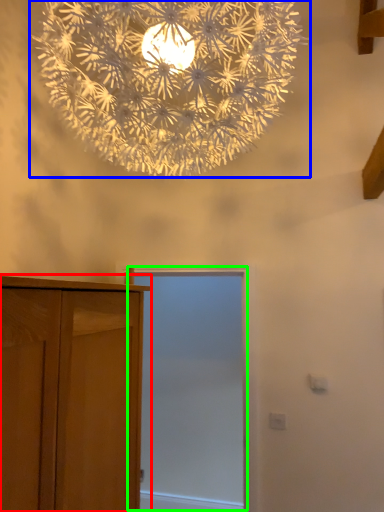
Question: Which is farther away from cupboard (highlighted by a red box)? lamp (highlighted by a blue box) or screen door (highlighted by a green box)?

Choices:
 (A) lamp
 (B) screen door

Answer: (B)